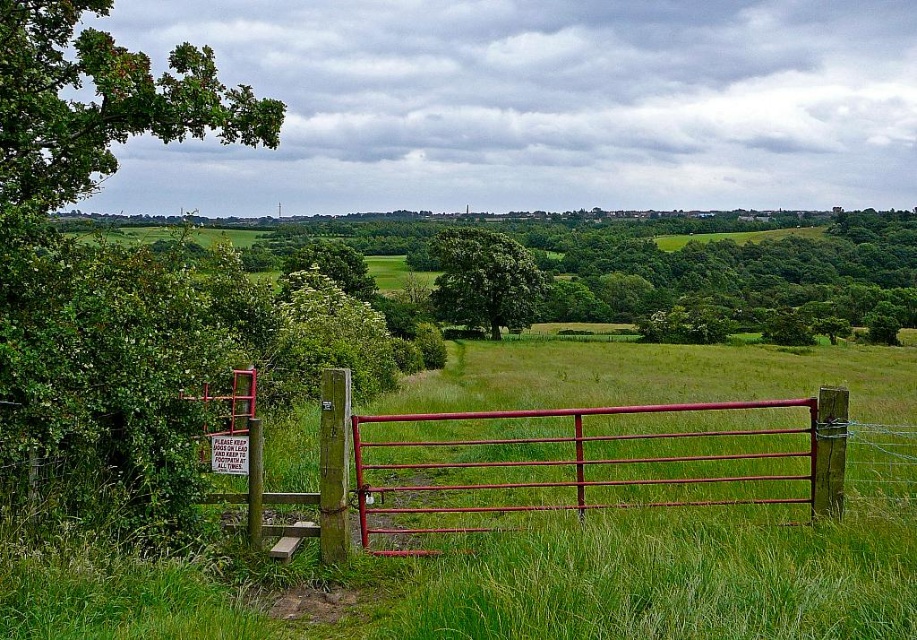
Is smooth metal gate at center above green leafy tree at center?

No.

The width and height of the screenshot is (917, 640). Find the location of `smooth metal gate at center`. smooth metal gate at center is located at coordinates (590, 461).

At what (x,y) coordinates should I click in order to perform the action: click on smooth metal gate at center. Please return your answer as a coordinate pair (x, y). Looking at the image, I should click on (590, 461).

You are a GUI agent. You are given a task and a screenshot of the screen. Output one action in this format:
    pyautogui.click(x=<x>, y=<y>)
    Task: Click on the smooth metal gate at center
    
    Given the screenshot: What is the action you would take?
    pyautogui.click(x=590, y=461)